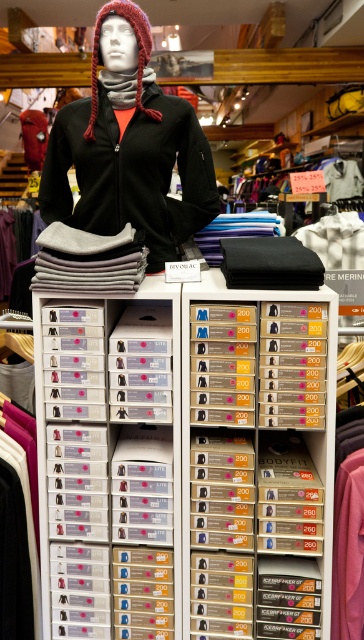
You are a customer in the store and want to find the clear plastic drawer at center. Where should you look?

The clear plastic drawer at center is located at point coordinates of (256, 460).

Based on the photo, you are standing in front of the retail display and want to touch both points labeled as point (274, 588) and point (66, 205). Which point should you reach for first to touch the one closer to you?

Point (274, 588) is closer to the viewer than point (66, 205), so you should reach for point (274, 588) first.

You are a customer in the store and want to pick up the clear plastic shoebox at center and the matte black jacket at center. Which item should you reach for first if you want to grab the one closer to you?

The clear plastic shoebox at center is closer to the viewer than the matte black jacket at center, so you should reach for the clear plastic shoebox at center first.